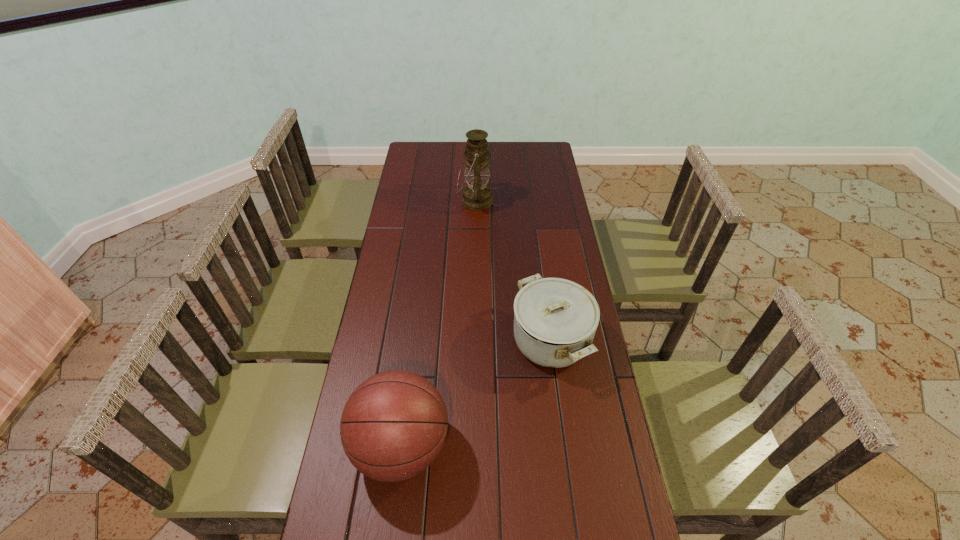
Find the location of `blank region between the nearest object and the tallest object`. blank region between the nearest object and the tallest object is located at coordinates pos(439,323).

Find the location of a particular element. unoccupied position between the oil lamp and the second farthest object is located at coordinates (513, 271).

Identify the location of free space between the oil lamp and the saucepan. This screenshot has height=540, width=960. tap(513, 271).

Find the location of `the second closest object to the tallest object`. the second closest object to the tallest object is located at coordinates point(393,426).

Identify which object is located as the second nearest to the second shortest object. Please provide its 2D coordinates. Your answer should be formatted as a tuple, i.e. [(x, y)], where the tuple contains the x and y coordinates of a point satisfying the conditions above.

[(477, 195)]